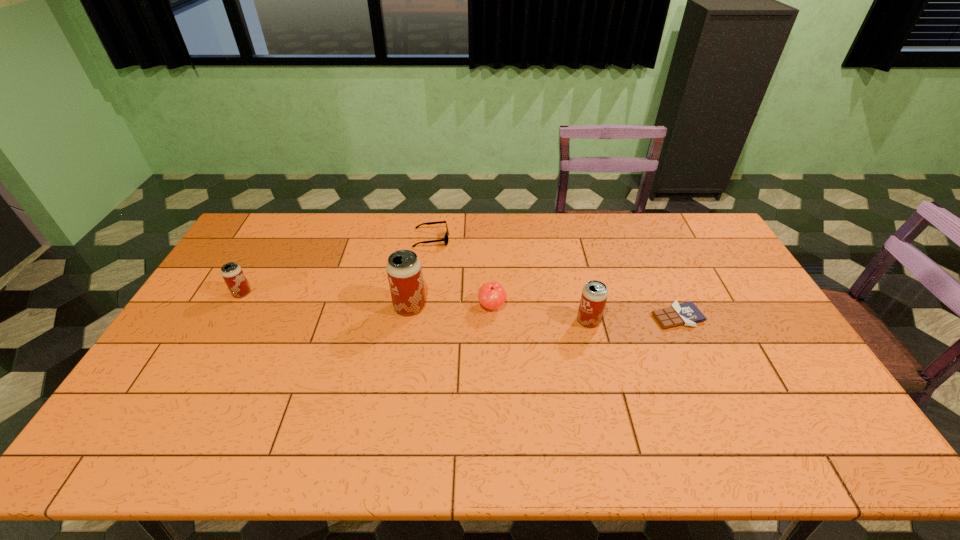
Please point a spot to add another beer can on the right. Please provide its 2D coordinates. Your answer should be formatted as a tuple, i.e. [(x, y)], where the tuple contains the x and y coordinates of a point satisfying the conditions above.

[(780, 336)]